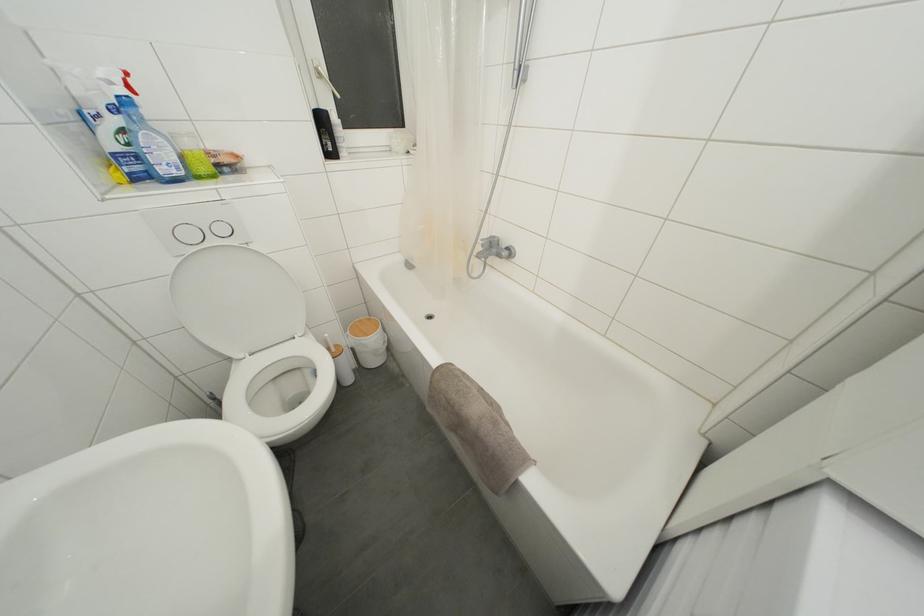
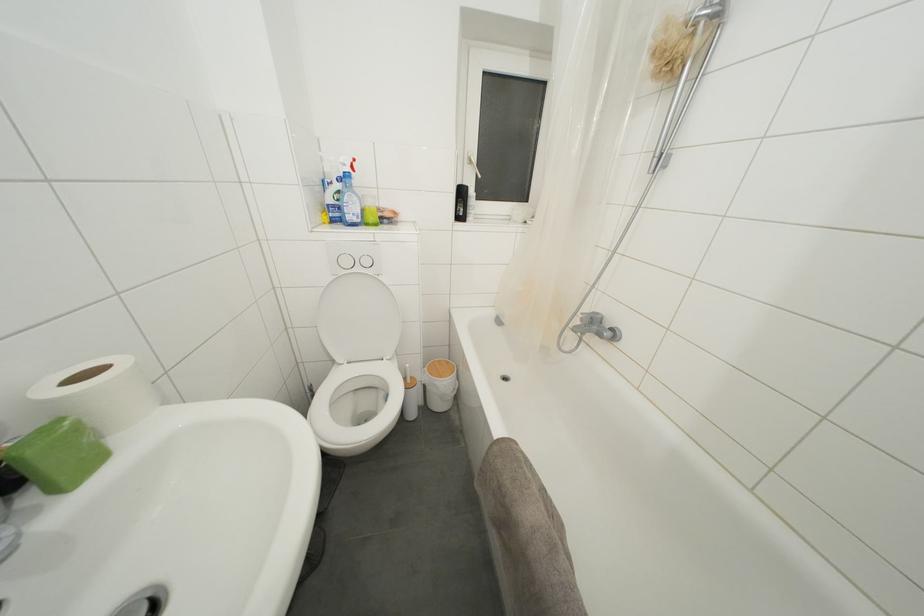
Question: The images are taken continuously from a first-person perspective. In which direction are you moving?

Choices:
 (A) Left
 (B) Right
 (C) Forward
 (D) Backward

Answer: (C)